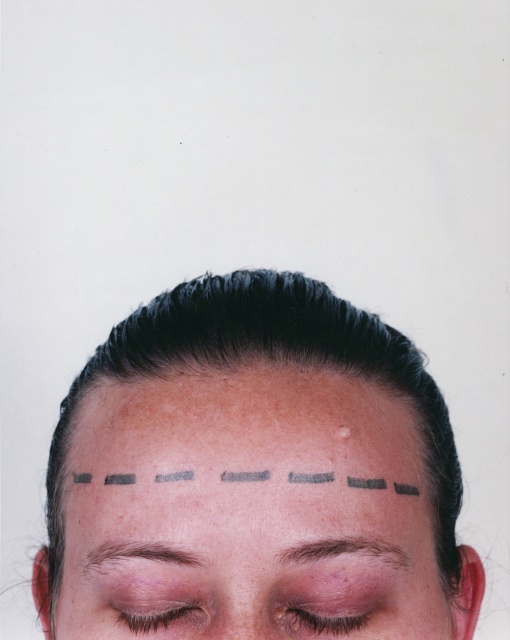
Question: Which point appears closest to the camera in this image?

Choices:
 (A) (91, 362)
 (B) (261, 627)

Answer: (B)

Question: Where is matte pink eyelid at center located in relation to brown textured eyelid at lower center in the image?

Choices:
 (A) left
 (B) right

Answer: (B)

Question: Is the position of matte pink eyelid at center less distant than that of brown hair at upper center?

Choices:
 (A) no
 (B) yes

Answer: (A)

Question: Which object is closer to the camera taking this photo?

Choices:
 (A) dry skin at center
 (B) smooth skin nose at center
 (C) matte gray dashed line at center
 (D) brown hair at upper center

Answer: (C)

Question: Is dry skin at center bigger than brown textured eyelid at lower center?

Choices:
 (A) no
 (B) yes

Answer: (B)

Question: Among these objects, which one is farthest from the camera?

Choices:
 (A) smooth skin nose at center
 (B) brown matte eyebrow at center
 (C) brown hair at upper center

Answer: (A)